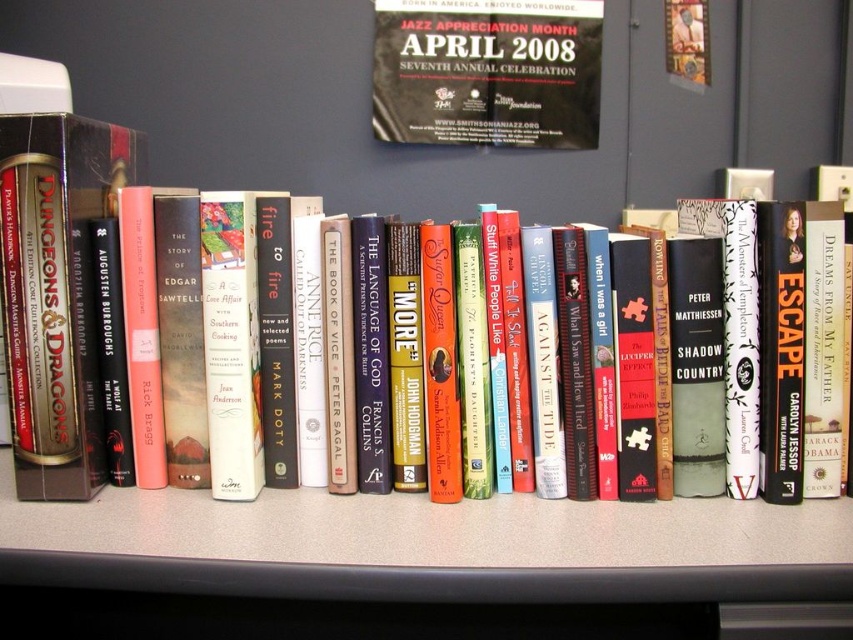
Question: Can you confirm if gray laminate table at center is bigger than hardcover book at center?

Choices:
 (A) yes
 (B) no

Answer: (A)

Question: Does gray laminate table at center have a larger size compared to hardcover book at center?

Choices:
 (A) no
 (B) yes

Answer: (B)

Question: Does gray laminate table at center appear on the right side of hardcover book at center?

Choices:
 (A) yes
 (B) no

Answer: (A)

Question: Among these objects, which one is farthest from the camera?

Choices:
 (A) gray laminate table at center
 (B) hardcover book at center

Answer: (B)

Question: Which point is closer to the camera?

Choices:
 (A) hardcover book at center
 (B) gray laminate table at center

Answer: (B)